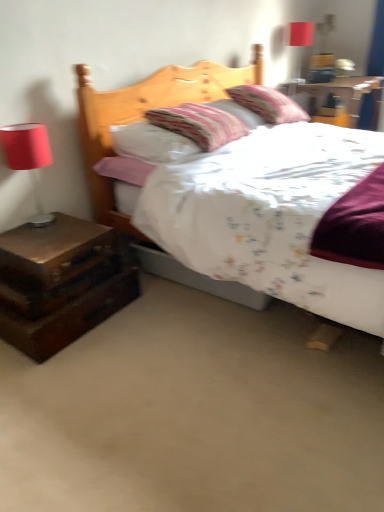
How much space does fluffy cotton pillow at upper center, the 2th pillow in the front-to-back sequence, occupy vertically?

fluffy cotton pillow at upper center, the 2th pillow in the front-to-back sequence, is 29.06 centimeters tall.

Where is `matte red lampshade at upper right`? This screenshot has height=512, width=384. matte red lampshade at upper right is located at coordinates (298, 44).

Find the location of a particular element. striped fabric pillow at center, which is counted as the 2th pillow, starting from the back is located at coordinates (199, 124).

How much space does brown wooden nightstand at left, which is the 3th nightstand from back to front, occupy horizontally?

It is 15.86 inches.

The height and width of the screenshot is (512, 384). In order to click on brown wooden nightstand at left, acting as the 3th nightstand starting from the right in this screenshot , I will do `click(53, 251)`.

This screenshot has width=384, height=512. In order to click on wooden drawer at left in this screenshot , I will do `click(57, 283)`.

Find the location of a particular element. matte red lampshade at left is located at coordinates (28, 159).

Where is `fluffy cotton pillow at upper center, the 2th pillow in the front-to-back sequence`? This screenshot has width=384, height=512. fluffy cotton pillow at upper center, the 2th pillow in the front-to-back sequence is located at coordinates (268, 104).

Between wooden nightstand at upper right, marked as the 3th nightstand in a left-to-right arrangement, and matte red lampshade at left, which one has smaller width?

Thinner between the two is matte red lampshade at left.

From a real-world perspective, who is located higher, wooden nightstand at upper right, marked as the 3th nightstand in a left-to-right arrangement, or matte red lampshade at left?

matte red lampshade at left is physically above.

Considering the positions of objects wooden nightstand at upper right, the 3th nightstand when ordered from front to back, and matte red lampshade at left in the image provided, who is more to the left, wooden nightstand at upper right, the 3th nightstand when ordered from front to back, or matte red lampshade at left?

matte red lampshade at left is more to the left.

Does point (30, 253) come closer to viewer compared to point (97, 239)?

Yes, it is in front of point (97, 239).

Considering the sizes of objects dark wood nightstand at lower left, the 3th nightstand positioned from the top, and brown wooden nightstand at left, acting as the 3th nightstand starting from the right, in the image provided, who is taller, dark wood nightstand at lower left, the 3th nightstand positioned from the top, or brown wooden nightstand at left, acting as the 3th nightstand starting from the right,?

Standing taller between the two is dark wood nightstand at lower left, the 3th nightstand positioned from the top.

Starting from the brown wooden nightstand at left, acting as the 3th nightstand starting from the right, which nightstand is the 1st one behind? Please provide its 2D coordinates.

[(60, 283)]

Which is more to the right, brown wooden nightstand at left, which is the 3th nightstand from back to front, or matte red lampshade at upper right?

matte red lampshade at upper right.

Locate an element on the screen. table lamp above the brown wooden nightstand at left, arranged as the second nightstand when viewed from the top (from a real-world perspective) is located at coordinates (298, 44).

Is brown wooden nightstand at left, which is the 3th nightstand from back to front, thinner than matte red lampshade at upper right?

No.

Based on the photo, do you think brown wooden nightstand at left, the first nightstand in the front-to-back sequence, is within matte red lampshade at upper right, or outside of it?

brown wooden nightstand at left, the first nightstand in the front-to-back sequence, exists outside the volume of matte red lampshade at upper right.

How distant is striped fabric pillow at center, which is counted as the 2th pillow, starting from the back, from wooden drawer at left?

striped fabric pillow at center, which is counted as the 2th pillow, starting from the back, is 29.73 inches away from wooden drawer at left.

Is striped fabric pillow at center, which is counted as the 2th pillow, starting from the back, oriented away from wooden drawer at left?

No, wooden drawer at left is not at the back of striped fabric pillow at center, which is counted as the 2th pillow, starting from the back.

At what (x,y) coordinates should I click in order to perform the action: click on drawer on the left of striped fabric pillow at center, acting as the 1th pillow starting from the front. Please return your answer as a coordinate pair (x, y). This screenshot has height=512, width=384. Looking at the image, I should click on (57, 283).

Which object is positioned more to the left, striped fabric pillow at center, which is counted as the 2th pillow, starting from the back, or wooden drawer at left?

wooden drawer at left.

Consider the image. Would you say wooden drawer at left contains matte red lampshade at upper right?

That's incorrect, matte red lampshade at upper right is not inside wooden drawer at left.

Is wooden drawer at left oriented away from matte red lampshade at upper right?

No, matte red lampshade at upper right is not at the back of wooden drawer at left.

Is wooden drawer at left not near matte red lampshade at upper right?

Yes, wooden drawer at left is far from matte red lampshade at upper right.

Does wooden drawer at left come in front of matte red lampshade at upper right?

Yes, it is in front of matte red lampshade at upper right.

From a real-world perspective, is wooden nightstand at upper right, the 3th nightstand when ordered from front to back, beneath brown wooden nightstand at left, the 1th nightstand positioned from the left?

No, from a real-world perspective, wooden nightstand at upper right, the 3th nightstand when ordered from front to back, is not below brown wooden nightstand at left, the 1th nightstand positioned from the left.

At what (x,y) coordinates should I click in order to perform the action: click on the 1st nightstand below when counting from the wooden nightstand at upper right, arranged as the 1th nightstand when viewed from the top (from the image's perspective). Please return your answer as a coordinate pair (x, y). The height and width of the screenshot is (512, 384). Looking at the image, I should click on (53, 251).

Visually, is wooden nightstand at upper right, the 3th nightstand ordered from the bottom, positioned to the left or to the right of brown wooden nightstand at left, the first nightstand in the front-to-back sequence?

Clearly, wooden nightstand at upper right, the 3th nightstand ordered from the bottom, is on the right of brown wooden nightstand at left, the first nightstand in the front-to-back sequence, in the image.

Considering the sizes of objects wooden nightstand at upper right, which is the first nightstand from right to left, and brown wooden nightstand at left, acting as the 3th nightstand starting from the right, in the image provided, who is taller, wooden nightstand at upper right, which is the first nightstand from right to left, or brown wooden nightstand at left, acting as the 3th nightstand starting from the right,?

With more height is wooden nightstand at upper right, which is the first nightstand from right to left.

Is wooden drawer at left directly adjacent to matte red lampshade at left?

They are not placed beside each other.

Which is more to the left, wooden drawer at left or matte red lampshade at left?

From the viewer's perspective, matte red lampshade at left appears more on the left side.

Does wooden drawer at left have a smaller size compared to matte red lampshade at left?

No, wooden drawer at left is not smaller than matte red lampshade at left.

Find the location of a particular element. This screenshot has height=512, width=384. bedside lamp behind the wooden drawer at left is located at coordinates (28, 159).

Starting from the matte red lampshade at left, which nightstand is the 3rd one to the right? Please provide its 2D coordinates.

[(343, 94)]

Locate an element on the screen. Image resolution: width=384 pixels, height=512 pixels. the 1st nightstand behind the brown wooden nightstand at left, arranged as the second nightstand when viewed from the top, counting from the anchor's position is located at coordinates (60, 283).

Looking at the image, which one is located closer to dark wood nightstand at lower left, arranged as the first nightstand when ordered from the bottom, wooden drawer at left or brown wooden nightstand at left, the first nightstand in the front-to-back sequence?

wooden drawer at left is positioned closer to the anchor dark wood nightstand at lower left, arranged as the first nightstand when ordered from the bottom.

From the image, which object appears to be farther from fluffy cotton pillow at upper center, the 2th pillow in the front-to-back sequence, striped fabric pillow at center, acting as the 1th pillow starting from the front, or dark wood nightstand at lower left, which is the second nightstand from left to right?

dark wood nightstand at lower left, which is the second nightstand from left to right, is further to fluffy cotton pillow at upper center, the 2th pillow in the front-to-back sequence.

Looking at the image, which one is located closer to matte red lampshade at upper right, brown wooden nightstand at left, the 1th nightstand positioned from the left, or wooden drawer at left?

Among the two, brown wooden nightstand at left, the 1th nightstand positioned from the left, is located nearer to matte red lampshade at upper right.

Looking at this image, considering their positions, is matte red lampshade at upper right positioned closer to matte red lampshade at left than fluffy cotton pillow at upper center, the 2th pillow in the front-to-back sequence?

fluffy cotton pillow at upper center, the 2th pillow in the front-to-back sequence.

When comparing their distances from dark wood nightstand at lower left, arranged as the second nightstand when viewed from the front, does wooden drawer at left or wooden nightstand at upper right, the 1th nightstand positioned from the back, seem closer?

Among the two, wooden drawer at left is located nearer to dark wood nightstand at lower left, arranged as the second nightstand when viewed from the front.

Considering their positions, is dark wood nightstand at lower left, which is the second nightstand from left to right, positioned closer to matte red lampshade at upper right than striped fabric pillow at center, which is counted as the 2th pillow, starting from the back?

Among the two, striped fabric pillow at center, which is counted as the 2th pillow, starting from the back, is located nearer to matte red lampshade at upper right.

From the image, which object appears to be nearer to matte red lampshade at upper right, wooden nightstand at upper right, the 3th nightstand when ordered from front to back, or striped fabric pillow at center, acting as the 1th pillow starting from the front?

The object closer to matte red lampshade at upper right is wooden nightstand at upper right, the 3th nightstand when ordered from front to back.

Which object lies nearer to the anchor point wooden drawer at left, wooden nightstand at upper right, the 3th nightstand ordered from the bottom, or matte red lampshade at upper right?

wooden nightstand at upper right, the 3th nightstand ordered from the bottom, lies closer to wooden drawer at left than the other object.

This screenshot has width=384, height=512. I want to click on nightstand between matte red lampshade at left and dark wood nightstand at lower left, arranged as the 2th nightstand when viewed from the back, vertically, so click(53, 251).

At what (x,y) coordinates should I click in order to perform the action: click on drawer situated between matte red lampshade at left and fluffy cotton pillow at upper center, the 2th pillow in the front-to-back sequence, from left to right. Please return your answer as a coordinate pair (x, y). Looking at the image, I should click on (57, 283).

Identify the location of pillow located between striped fabric pillow at center, which is counted as the 2th pillow, starting from the back, and matte red lampshade at upper right in the depth direction. This screenshot has height=512, width=384. (268, 104).

Find the location of a particular element. This screenshot has height=512, width=384. bedside lamp between striped fabric pillow at center, which is counted as the 2th pillow, starting from the back, and dark wood nightstand at lower left, arranged as the second nightstand when viewed from the front, from top to bottom is located at coordinates (28, 159).